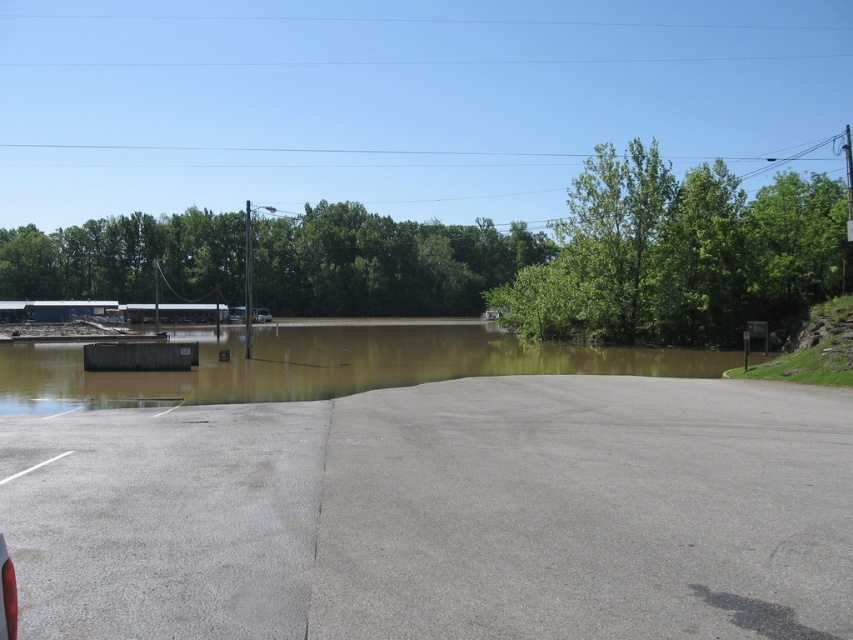
What are the coordinates of the gray asphalt parking lot at center?

The gray asphalt parking lot at center is located at coordinates point (x=444, y=515).

You are a pedestrian trying to reach the other side of the flooded area. You see the brown murky water at lower left and the silver metallic car at center. Which object is closer to your starting position if you are standing at the edge of the scene on the left?

The brown murky water at lower left is to the right of the silver metallic car at center, meaning the silver metallic car at center is closer to your starting position on the left edge of the scene.

You are standing at the point marked by the coordinates point (323,365) in the flooded area. Based on the scene description, what is the primary substance you are likely standing on?

The point (323,365) indicates brown murky water at lower left, so you are likely standing on brown murky water at lower left.